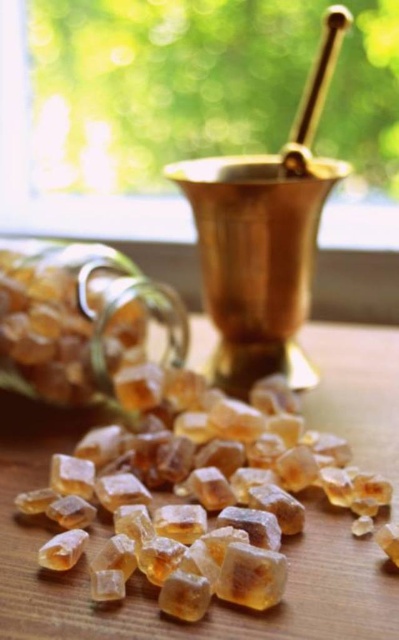
Who is positioned more to the right, gold metallic mortar at upper center or translucent amber glass jar at lower left?

Positioned to the right is gold metallic mortar at upper center.

Looking at this image, measure the distance between gold metallic mortar at upper center and camera.

A distance of 92.72 centimeters exists between gold metallic mortar at upper center and camera.

Identify the location of gold metallic mortar at upper center. The width and height of the screenshot is (399, 640). (264, 236).

Between translucent amber crystal at center and transparent glass window at upper center, which one is positioned lower?

translucent amber crystal at center is lower down.

Is the position of translucent amber crystal at center less distant than that of transparent glass window at upper center?

Yes, translucent amber crystal at center is in front of transparent glass window at upper center.

Measure the distance between point (120, 508) and camera.

Point (120, 508) is 29.35 inches away from camera.

Where is `translucent amber crystal at center`? This screenshot has width=399, height=640. translucent amber crystal at center is located at coordinates (199, 493).

Does gold metallic mortar at upper center have a greater height compared to transparent glass window at upper center?

Correct, gold metallic mortar at upper center is much taller as transparent glass window at upper center.

Does gold metallic mortar at upper center appear over transparent glass window at upper center?

No, gold metallic mortar at upper center is not above transparent glass window at upper center.

At what (x,y) coordinates should I click in order to perform the action: click on gold metallic mortar at upper center. Please return your answer as a coordinate pair (x, y). The image size is (399, 640). Looking at the image, I should click on (264, 236).

In order to click on gold metallic mortar at upper center in this screenshot , I will do `click(264, 236)`.